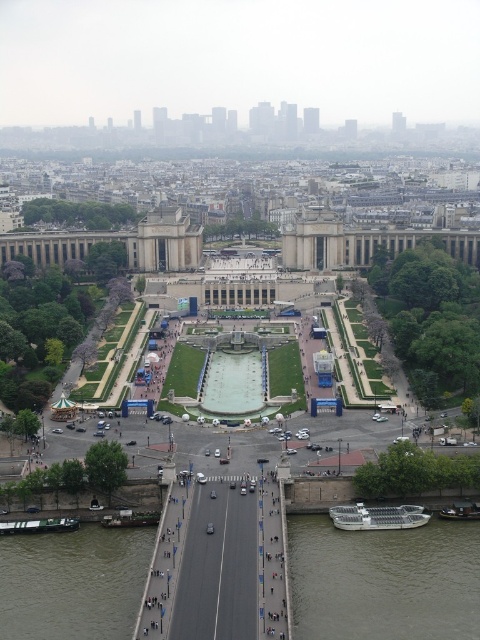
Is brown murky water at lower left to the right of black rubber boat at lower right from the viewer's perspective?

Incorrect, brown murky water at lower left is not on the right side of black rubber boat at lower right.

Who is lower down, brown murky water at lower left or black rubber boat at lower right?

Positioned lower is brown murky water at lower left.

From the picture: Who is more forward, (x=96, y=540) or (x=474, y=509)?

Positioned in front is point (x=96, y=540).

The image size is (480, 640). Identify the location of brown murky water at lower left. (72, 582).

Between metallic silver boat at lower right and wooden boat at lower left, which one appears on the left side from the viewer's perspective?

wooden boat at lower left is more to the left.

Consider the image. Does metallic silver boat at lower right have a smaller size compared to wooden boat at lower left?

Actually, metallic silver boat at lower right might be larger than wooden boat at lower left.

Measure the distance between metallic silver boat at lower right and camera.

The distance of metallic silver boat at lower right from camera is 94.35 meters.

I want to click on metallic silver boat at lower right, so click(x=377, y=516).

Is point (70, 529) in front of point (100, 522)?

That is True.

Locate an element on the screen. The image size is (480, 640). white plastic boat at lower left is located at coordinates (38, 525).